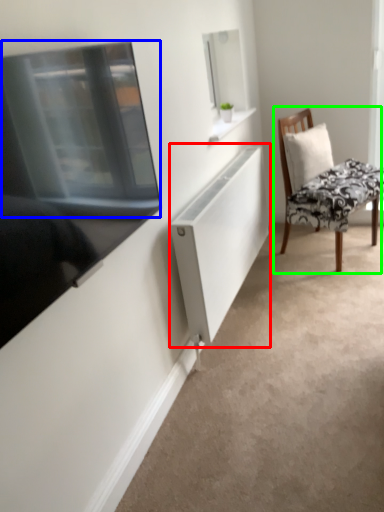
Question: Which object is positioned closest to cabinet (highlighted by a red box)? Select from window screen (highlighted by a blue box) and chair (highlighted by a green box).

Choices:
 (A) window screen
 (B) chair

Answer: (B)